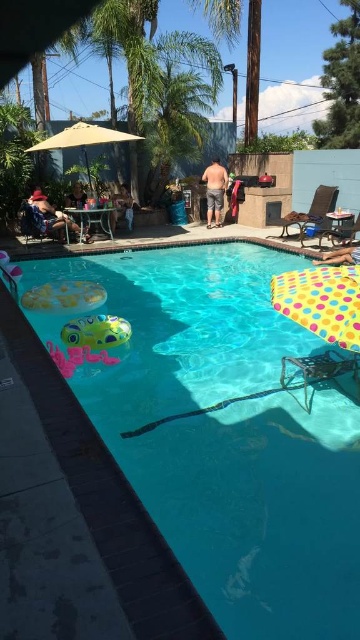
Question: Can you confirm if metallic silver chair at lower right is positioned to the left of smooth tan skin at lower right?

Choices:
 (A) yes
 (B) no

Answer: (A)

Question: Estimate the real-world distances between objects in this image. Which object is farther from the transparent plastic pool at center?

Choices:
 (A) tan skin person at center
 (B) yellow polka dot fabric chair at lower right

Answer: (A)

Question: Which point appears farthest from the camera in this image?

Choices:
 (A) (295, 362)
 (B) (214, 205)

Answer: (B)

Question: Does matte black sunglasses at lower left have a lesser width compared to tan skin person at center?

Choices:
 (A) no
 (B) yes

Answer: (A)

Question: Among these points, which one is nearest to the camera?

Choices:
 (A) (x=321, y=220)
 (B) (x=326, y=262)

Answer: (B)

Question: Can you confirm if green leafy palm tree at upper center is positioned to the right of brown woven chair at upper right?

Choices:
 (A) yes
 (B) no

Answer: (B)